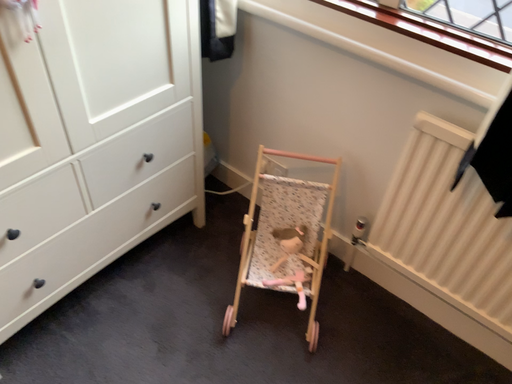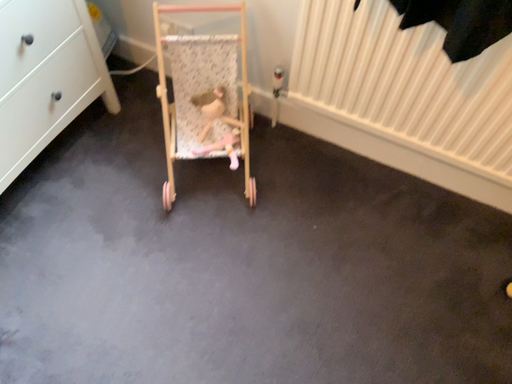
Question: How did the camera likely rotate when shooting the video?

Choices:
 (A) rotated right
 (B) rotated left

Answer: (A)